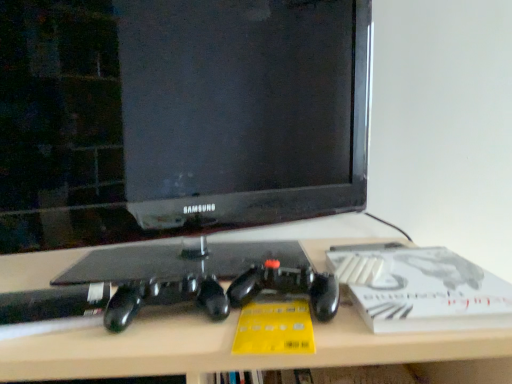
Question: Considering the relative sizes of white matte paperback book at right and black glossy monitor at center in the image provided, is white matte paperback book at right bigger than black glossy monitor at center?

Choices:
 (A) yes
 (B) no

Answer: (B)

Question: Is the position of white matte paperback book at right more distant than that of black glossy monitor at center?

Choices:
 (A) yes
 (B) no

Answer: (B)

Question: Is white matte paperback book at right positioned before black glossy monitor at center?

Choices:
 (A) yes
 (B) no

Answer: (A)

Question: Considering the relative sizes of white matte paperback book at right and black glossy monitor at center in the image provided, is white matte paperback book at right smaller than black glossy monitor at center?

Choices:
 (A) no
 (B) yes

Answer: (B)

Question: Is white matte paperback book at right wider than black glossy monitor at center?

Choices:
 (A) yes
 (B) no

Answer: (A)

Question: Relative to white matte paperback book at right, is matte black desk at center in front or behind?

Choices:
 (A) behind
 (B) front

Answer: (B)

Question: From a real-world perspective, is matte black desk at center positioned above or below white matte paperback book at right?

Choices:
 (A) above
 (B) below

Answer: (B)

Question: Based on their positions, is matte black desk at center located to the left or right of white matte paperback book at right?

Choices:
 (A) right
 (B) left

Answer: (B)

Question: In terms of width, does matte black desk at center look wider or thinner when compared to white matte paperback book at right?

Choices:
 (A) thin
 (B) wide

Answer: (B)

Question: Based on their sizes in the image, would you say black glossy monitor at center is bigger or smaller than matte black desk at center?

Choices:
 (A) small
 (B) big

Answer: (A)

Question: Considering the positions of point (190, 158) and point (140, 339), is point (190, 158) closer or farther from the camera than point (140, 339)?

Choices:
 (A) farther
 (B) closer

Answer: (A)

Question: From the image's perspective, is black glossy monitor at center above or below matte black desk at center?

Choices:
 (A) below
 (B) above

Answer: (B)

Question: Considering the positions of black glossy monitor at center and matte black desk at center in the image, is black glossy monitor at center taller or shorter than matte black desk at center?

Choices:
 (A) short
 (B) tall

Answer: (B)

Question: Do you think black glossy monitor at center is within white matte paperback book at right, or outside of it?

Choices:
 (A) outside
 (B) inside

Answer: (A)

Question: Would you say black glossy monitor at center is to the left or to the right of white matte paperback book at right in the picture?

Choices:
 (A) right
 (B) left

Answer: (B)